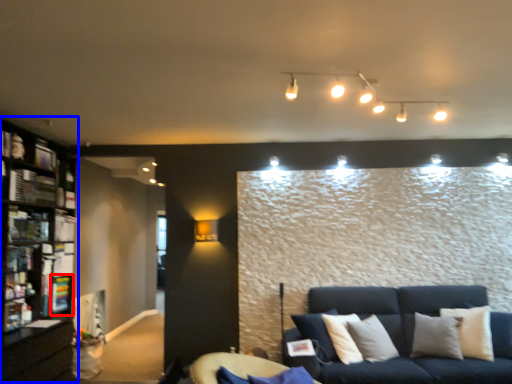
Question: Which object is further to the camera taking this photo, shelf (highlighted by a red box) or bookcase (highlighted by a blue box)?

Choices:
 (A) shelf
 (B) bookcase

Answer: (A)